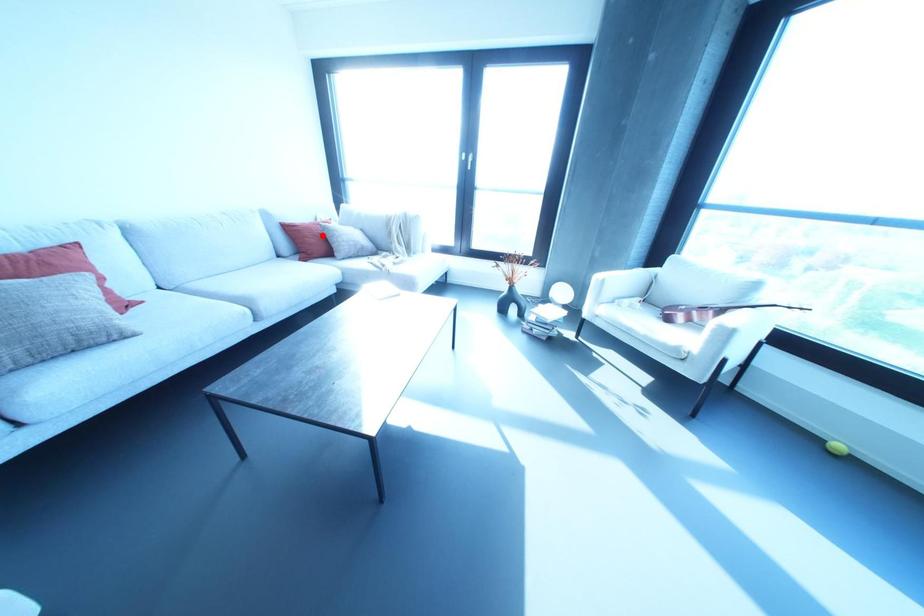
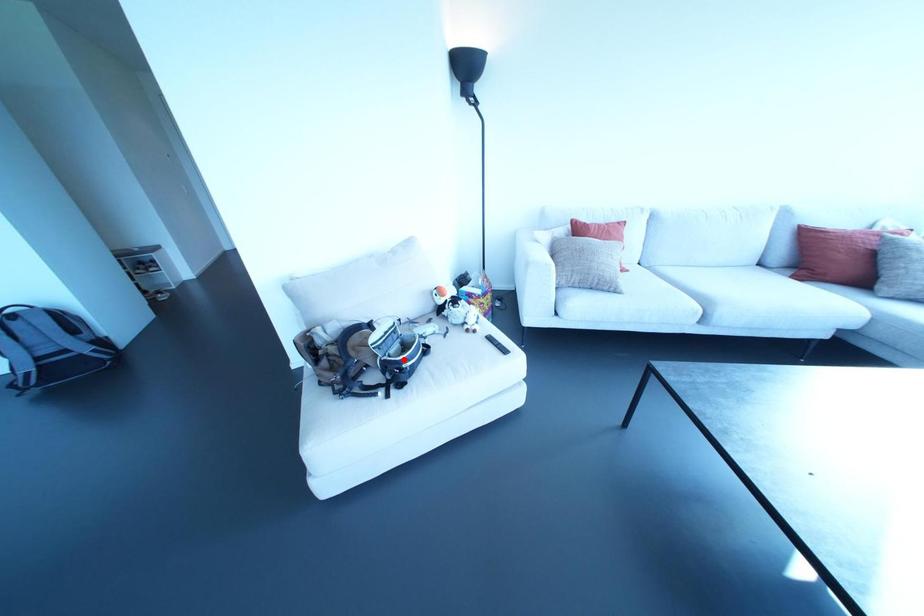
I am providing you with two images of the same scene from different viewpoints. A red point is marked on the first image and another point is marked on the second image. Is the marked point in image1 the same physical position as the marked point in image2?

No